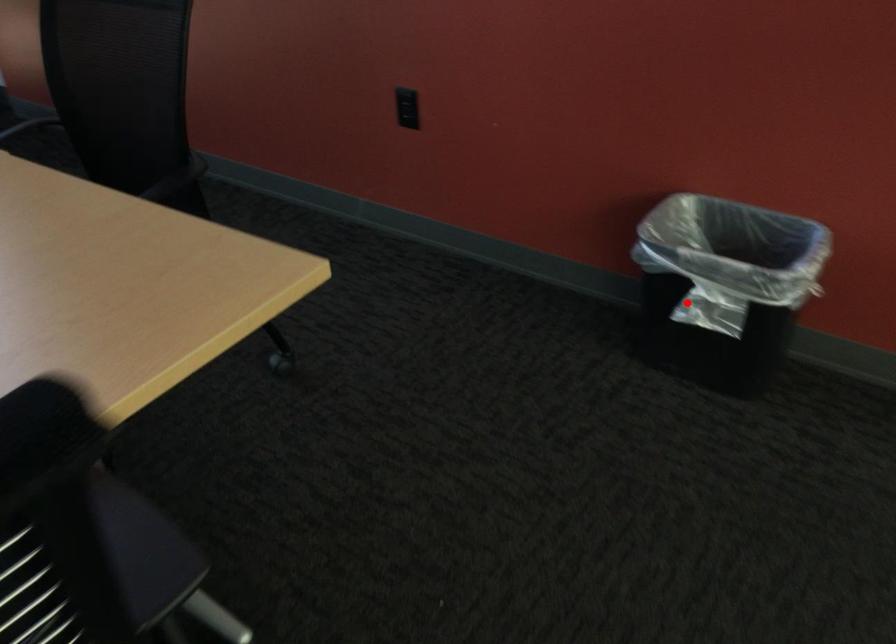
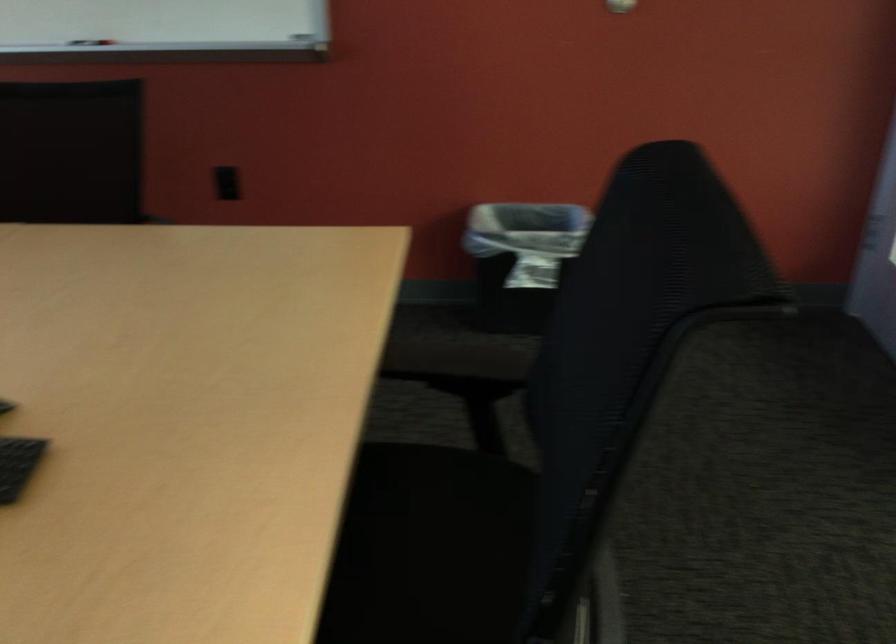
Question: I am providing you with two images of the same scene from different viewpoints. Given a red point in image1, look at the same physical point in image2. Is it:

Choices:
 (A) Closer to the viewpoint
 (B) Farther from the viewpoint

Answer: (B)